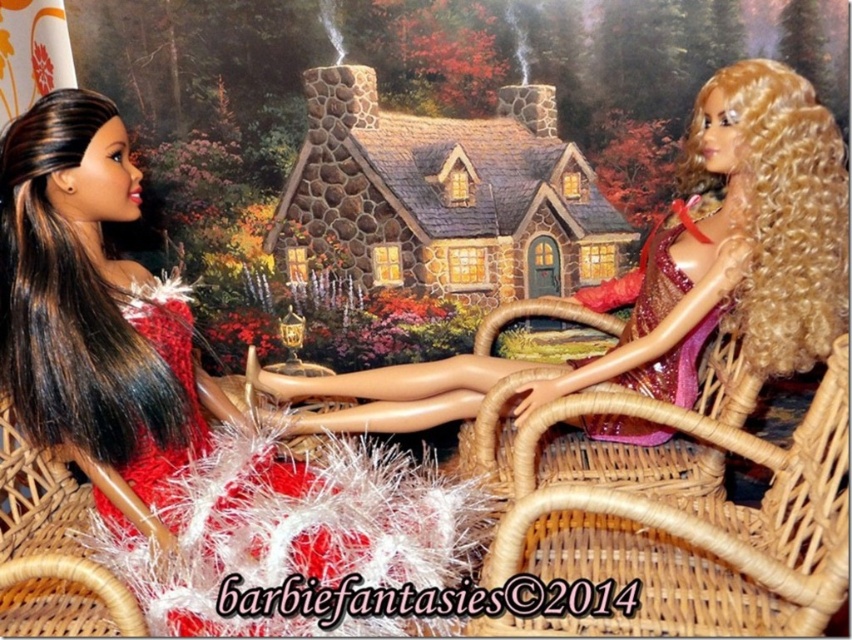
You are standing in front of the dolls and notice a point marked at coordinates (180, 403). Which doll is this point indicating?

The point at coordinates (180, 403) marks the shiny red dress at left.

In the scene shown: You are a photographer setting up a shoot with two dolls wearing the shiny red dress at left and the shiny pink fabric dress at right. You want to ensure the dolls are visible in the photo. Which dress should be placed closer to the camera to ensure both are visible?

The shiny red dress at left should be placed closer to the camera since it is already in front of the shiny pink fabric dress at right, ensuring both are visible in the photo.

You are a photographer setting up a shoot with two dolls. You need to adjust the lighting so that the shiny red dress at left and the woven wicker chair at center are both well lit. Based on their positions, which object should you light first to ensure proper illumination?

The shiny red dress at left should be lit first since it is positioned to the left of the woven wicker chair at center, so adjusting its lighting will help establish the baseline for the scene.